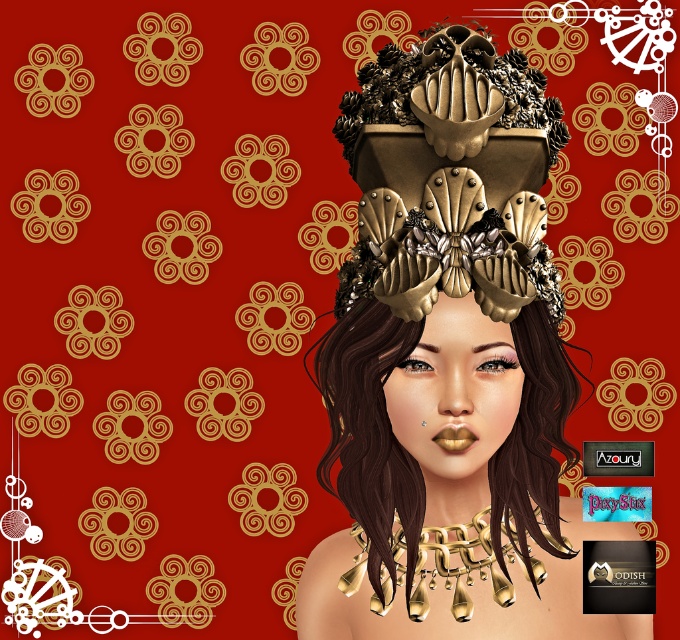
This screenshot has height=640, width=680. Identify the location of shiny brown hair at center. (371, 433).

Is shiny brown hair at center below gold metallic necklace at lower center?

No.

Is point (411, 497) positioned before point (483, 534)?

Yes.

Where is `shiny brown hair at center`? The width and height of the screenshot is (680, 640). shiny brown hair at center is located at coordinates (371, 433).

Between shiny brown hair at center and gold metallic headdress at center, which one has less height?

gold metallic headdress at center

Is shiny brown hair at center to the left of gold metallic headdress at center from the viewer's perspective?

Indeed, shiny brown hair at center is positioned on the left side of gold metallic headdress at center.

At what (x,y) coordinates should I click in order to perform the action: click on shiny brown hair at center. Please return your answer as a coordinate pair (x, y). The width and height of the screenshot is (680, 640). Looking at the image, I should click on (371, 433).

Find the location of `shiny brown hair at center`. shiny brown hair at center is located at coordinates (371, 433).

Is point (403, 243) in front of point (403, 541)?

Yes, it is.

Does gold metallic headdress at center appear on the right side of gold metallic necklace at lower center?

Yes, gold metallic headdress at center is to the right of gold metallic necklace at lower center.

Where is `gold metallic headdress at center`? gold metallic headdress at center is located at coordinates (449, 250).